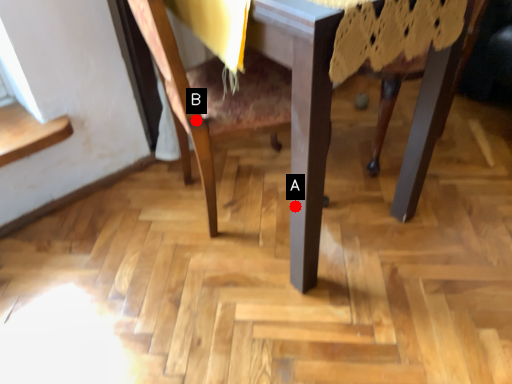
Question: Two points are circled on the image, labeled by A and B beside each circle. Which of the following is the closest to the observer?

Choices:
 (A) A is closer
 (B) B is closer

Answer: (A)